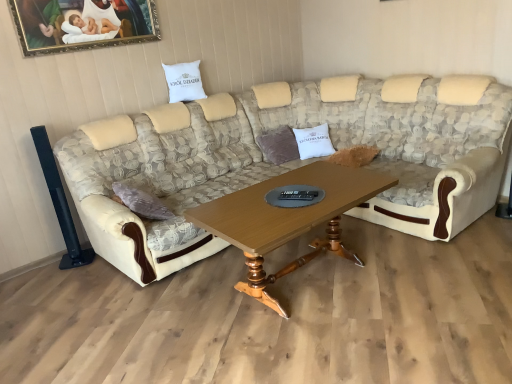
The image size is (512, 384). I want to click on vacant space positioned to the left of woodenwoodencoffee table at center, so click(172, 316).